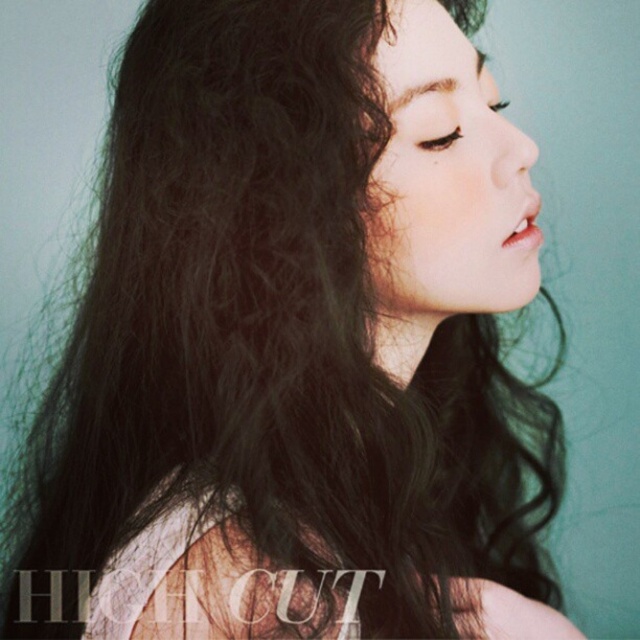
Can you confirm if matte black eye at upper center is positioned to the right of black matte eye at upper center?

In fact, matte black eye at upper center is to the left of black matte eye at upper center.

Find the location of `matte black eye at upper center`. matte black eye at upper center is located at coordinates (440, 140).

At what (x,y) coordinates should I click in order to perform the action: click on matte black eye at upper center. Please return your answer as a coordinate pair (x, y). Looking at the image, I should click on (440, 140).